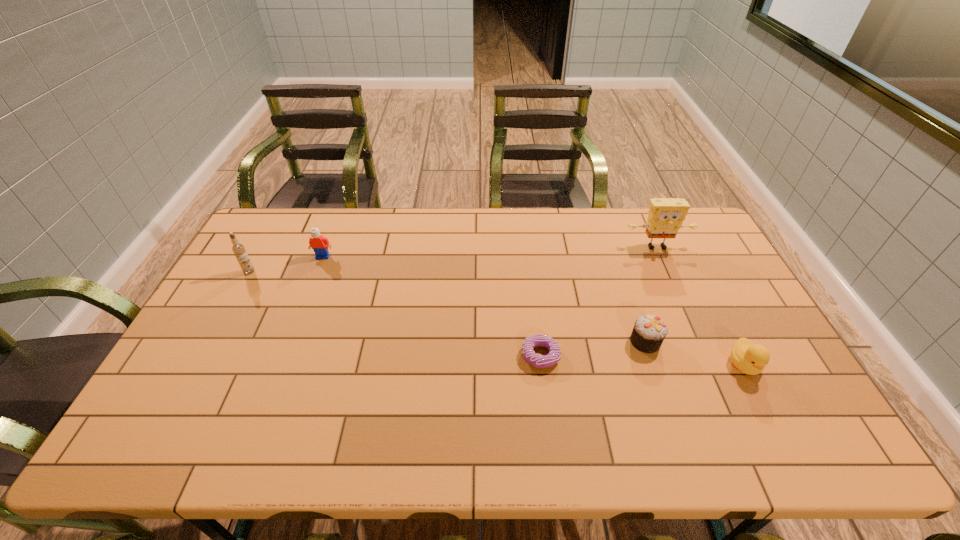
Image resolution: width=960 pixels, height=540 pixels. In order to click on sponge in this screenshot , I will do `click(665, 216)`.

Image resolution: width=960 pixels, height=540 pixels. What are the coordinates of `the fourth nearest object` in the screenshot? It's located at (238, 249).

Image resolution: width=960 pixels, height=540 pixels. I want to click on the leftmost object, so click(238, 249).

Identify the location of the third tallest object. The height and width of the screenshot is (540, 960). (317, 242).

Find the location of a particular element. Lego is located at coordinates (317, 242).

This screenshot has width=960, height=540. What are the coordinates of `duck` in the screenshot? It's located at (748, 358).

Find the location of a particular element. The width and height of the screenshot is (960, 540). cupcake is located at coordinates (649, 331).

In order to click on doughnut in this screenshot , I will do `click(538, 340)`.

This screenshot has height=540, width=960. I want to click on the shortest object, so click(x=538, y=340).

You are a GUI agent. You are given a task and a screenshot of the screen. Output one action in this format:
    pyautogui.click(x=<x>, y=<y>)
    Task: Click on the free space located 0.350m on the face of the sponge
    
    Given the screenshot: What is the action you would take?
    pyautogui.click(x=696, y=336)